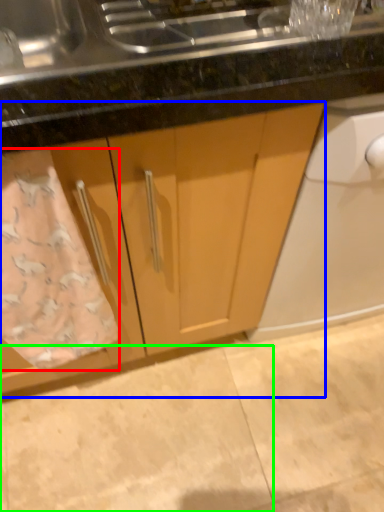
Question: Which object is positioned closest to bath towel (highlighted by a red box)? Select from cabinetry (highlighted by a blue box) and granite (highlighted by a green box).

Choices:
 (A) cabinetry
 (B) granite

Answer: (A)